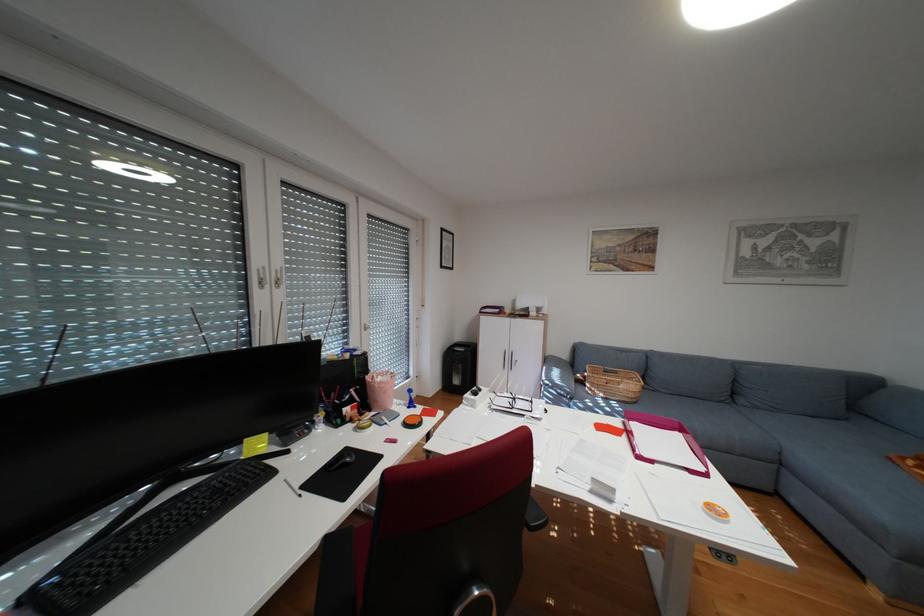
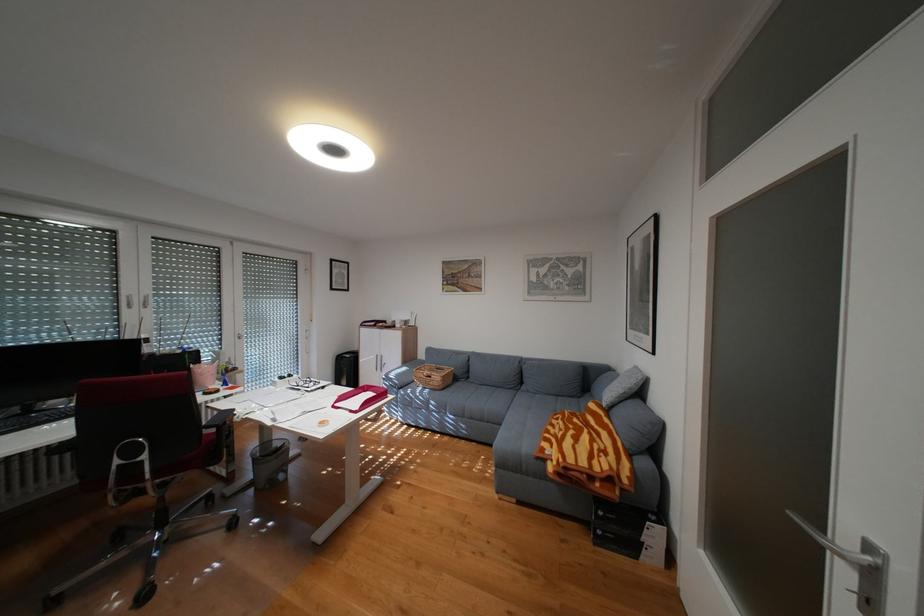
In the second image, find the point that corresponds to the point at 651,456 in the first image.

(346, 406)